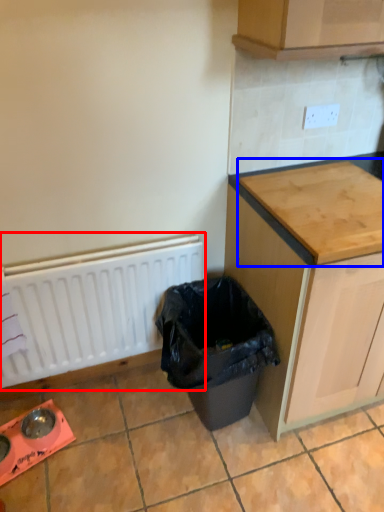
Question: Which object appears farthest to the camera in this image, radiator (highlighted by a red box) or countertop (highlighted by a blue box)?

Choices:
 (A) radiator
 (B) countertop

Answer: (A)